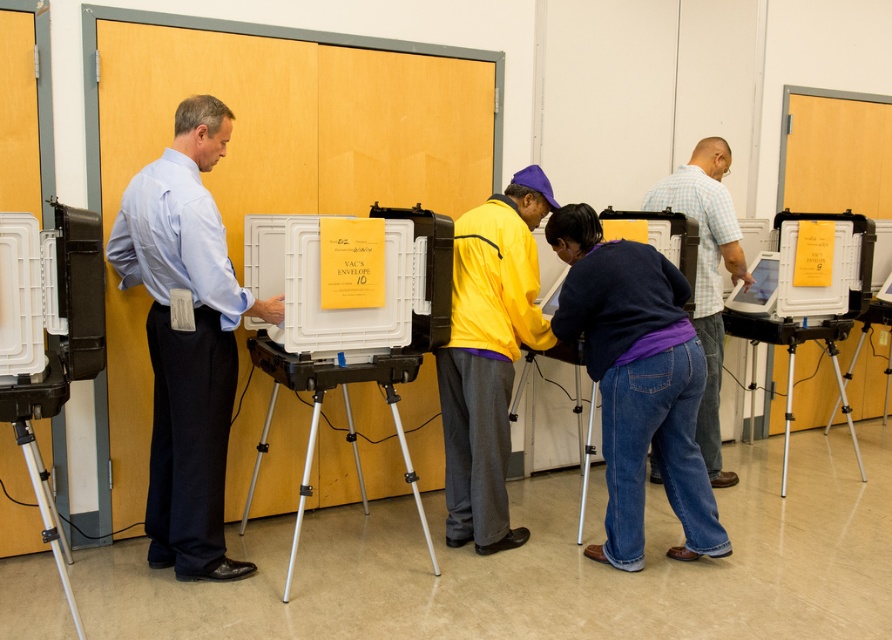
You are a photographer setting up a camera on a tripod. You notice the denim jeans at center and the silver metallic tripod at lower left in the scene. Which object is wider according to the description?

The denim jeans at center might be wider than silver metallic tripod at lower left.

Based on the photo, you are standing in the polling station and need to determine which of the two points, point (255, 305) or point (500, 500), is nearer to you. Based on the scene description, which point is closer?

Point (255, 305) is closer to the viewer than point (500, 500).